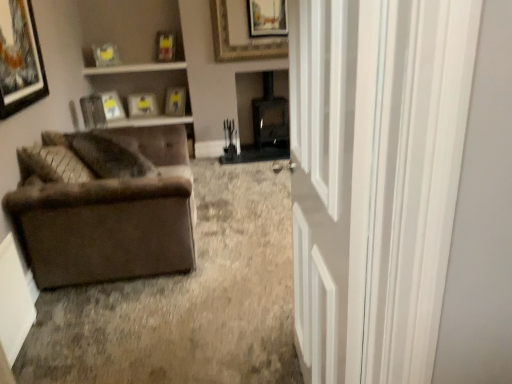
Question: In the image, is matte wooden picture frame at upper left, which is the third picture frame from back to front, positioned in front of or behind matte yellow picture frame at upper left, the fourth picture frame from the front?

Choices:
 (A) front
 (B) behind

Answer: (B)

Question: Considering the positions of matte wooden picture frame at upper left, which is the sixth picture frame from front to back, and matte yellow picture frame at upper left, the 5th picture frame from the back, in the image, is matte wooden picture frame at upper left, which is the sixth picture frame from front to back, bigger or smaller than matte yellow picture frame at upper left, the 5th picture frame from the back,?

Choices:
 (A) small
 (B) big

Answer: (B)

Question: Which object is positioned farthest from the matte yellow picture frame at upper left, the 5th picture frame from the back?

Choices:
 (A) matte wooden picture frame at upper center, placed as the 8th picture frame when sorted from front to back
 (B) white wood window sill at upper center, the 2th window sill viewed from the top
 (C) matte plastic picture frame at upper center, the 5th picture frame in the front-to-back sequence
 (D) matte wooden picture frame at upper left, which is the third picture frame from back to front
 (E) matte black picture frame at upper left, marked as the 1th picture frame in a front-to-back arrangement

Answer: (E)

Question: Estimate the real-world distances between objects in this image. Which object is farther from the matte black picture frame at upper left, marked as the 1th picture frame in a front-to-back arrangement?

Choices:
 (A) matte wooden picture frame at upper left, which is the third picture frame from back to front
 (B) matte yellow picture frame at upper center, acting as the 7th picture frame starting from the front
 (C) white glossy door at right
 (D) matte yellow picture frame at upper left, the fourth picture frame from the front
 (E) matte plastic picture frame at upper center, the 5th picture frame in the front-to-back sequence

Answer: (B)